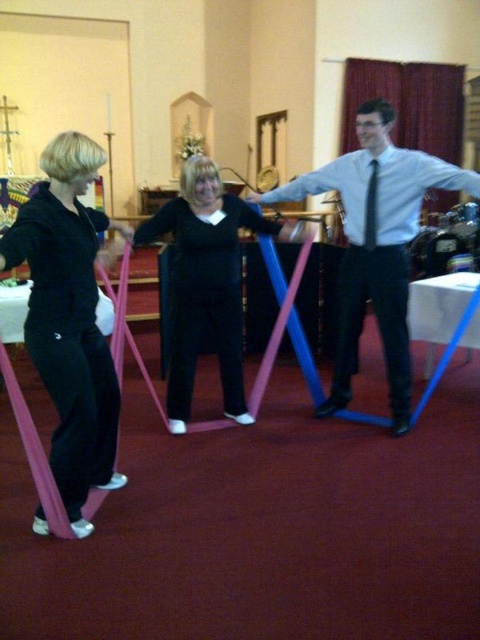
You are organizing a costume party and need to decide which item can be used as a makeshift belt. Based on their widths, which of the following items would be more suitable between the black matte leggings at center and the black satin tie at center?

The black matte leggings at center is wider than the black satin tie at center, making it more suitable as a makeshift belt.

Looking at this image, you are a fashion designer observing the scene. You notice the black matte leggings at center and the black satin tie at center. Which item is positioned lower on the person wearing them?

The black matte leggings at center is below the black satin tie at center, so the black matte leggings at center is positioned lower on the person wearing them.